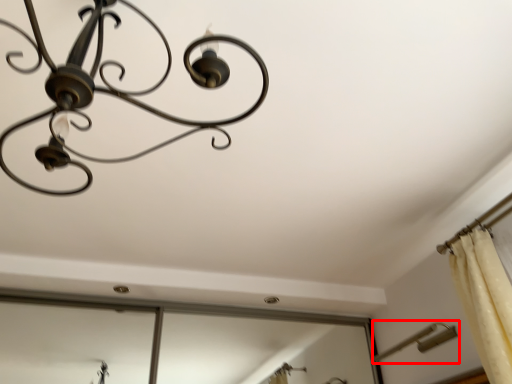
Question: Where is lamp (annotated by the red box) located in relation to lamp in the image?

Choices:
 (A) right
 (B) left

Answer: (A)